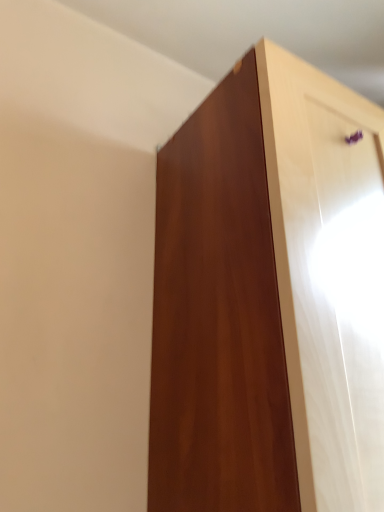
You are a GUI agent. You are given a task and a screenshot of the screen. Output one action in this format:
    pyautogui.click(x=<x>, y=<y>)
    Task: Click on the wooden cupboard at upper right
    Image resolution: width=384 pixels, height=512 pixels.
    Given the screenshot: What is the action you would take?
    pyautogui.click(x=270, y=297)

The width and height of the screenshot is (384, 512). What do you see at coordinates (270, 297) in the screenshot?
I see `wooden cupboard at upper right` at bounding box center [270, 297].

Find the location of a particular element. The height and width of the screenshot is (512, 384). wooden cupboard at upper right is located at coordinates (270, 297).